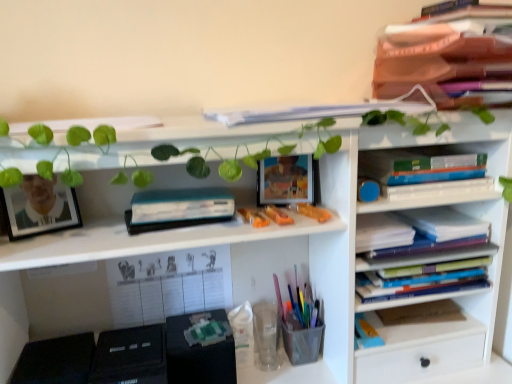
Where is `free space above hardcover book at upper right, marked as the 7th book in a bottom-to-top arrangement (from a real-world perspective)`? The image size is (512, 384). free space above hardcover book at upper right, marked as the 7th book in a bottom-to-top arrangement (from a real-world perspective) is located at coordinates coord(419,151).